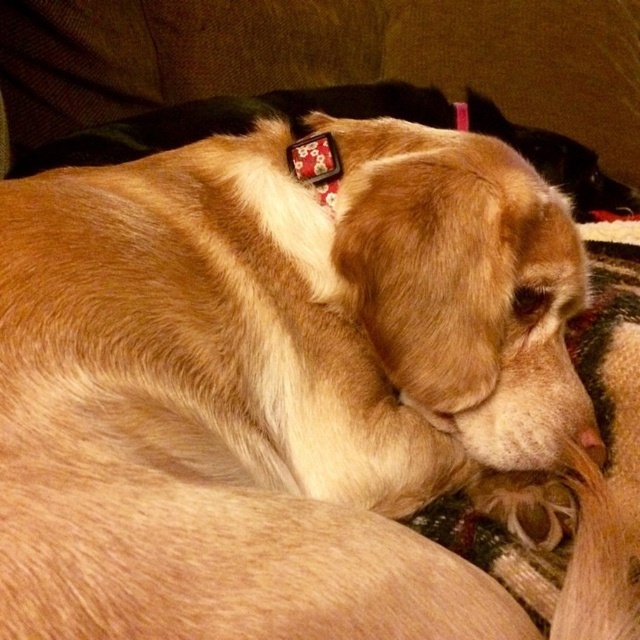
Question: Which of the following is the farthest from the observer?

Choices:
 (A) (333, 140)
 (B) (540, 616)

Answer: (A)

Question: Is fuzzy fabric dog bed at center closer to the viewer compared to floral fabric collar at upper center?

Choices:
 (A) no
 (B) yes

Answer: (B)

Question: Does fuzzy fabric dog bed at center have a larger size compared to floral fabric collar at upper center?

Choices:
 (A) no
 (B) yes

Answer: (B)

Question: Does fuzzy fabric dog bed at center appear under floral fabric collar at upper center?

Choices:
 (A) yes
 (B) no

Answer: (A)